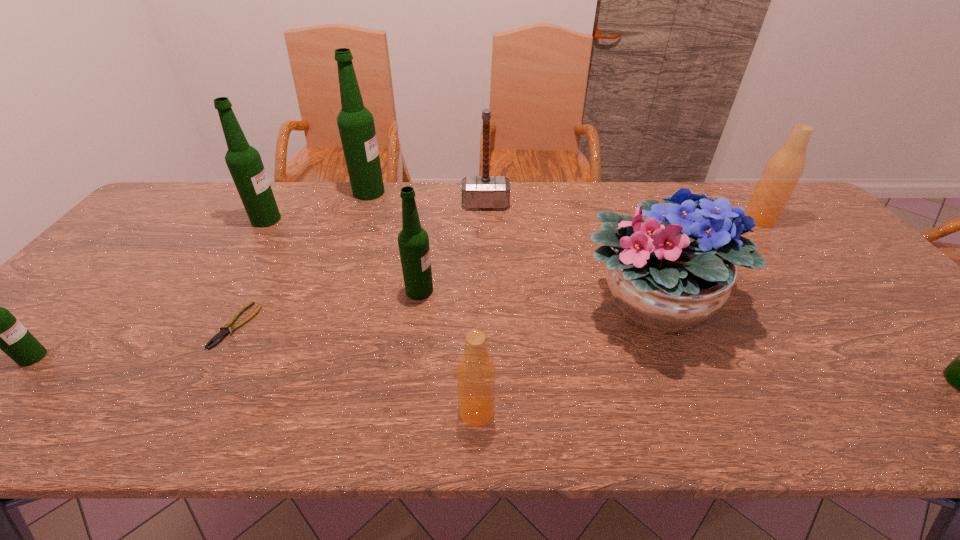
This screenshot has width=960, height=540. I want to click on the third object from right to left, so click(675, 270).

The image size is (960, 540). What are the coordinates of `the leftmost green beer bottle` in the screenshot? It's located at (0, 329).

Locate an element on the screen. This screenshot has width=960, height=540. the second nearest green beer bottle is located at coordinates (0, 329).

I want to click on the third beer bottle from right to left, so click(475, 371).

Locate an element on the screen. This screenshot has width=960, height=540. the nearer tan beer bottle is located at coordinates tap(475, 371).

Where is `yellow pliers`? The width and height of the screenshot is (960, 540). yellow pliers is located at coordinates (227, 328).

Image resolution: width=960 pixels, height=540 pixels. Identify the location of the shortest object. (227, 328).

Find the location of `free space located 0.060m on the label of the biggest green beer bottle`. free space located 0.060m on the label of the biggest green beer bottle is located at coordinates (402, 192).

Locate an element on the screen. This screenshot has width=960, height=540. free location located on the label of the second beer bottle from left to right is located at coordinates (335, 219).

Where is `vacant space located on the striking surface of the brown hammer`? The height and width of the screenshot is (540, 960). vacant space located on the striking surface of the brown hammer is located at coordinates (486, 234).